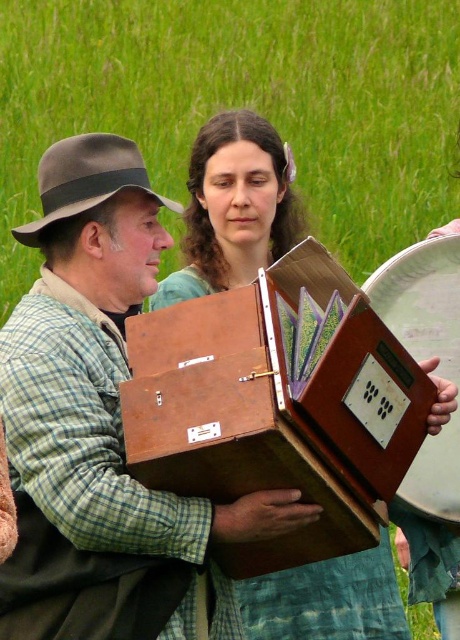
You are setting up for a street performance and need to place the wooden accordion at center and the wooden box at center on a small stage. The stage has limited vertical space. Based on the image, which object should you avoid placing if you want to maximize the number of items you can fit vertically?

The wooden accordion at center is much taller than the wooden box at center, so you should avoid placing the wooden accordion at center to maximize the number of items you can fit vertically.

You are standing in front of the two performers and want to take a photo of the wooden box at center without the wooden accordion at center blocking it. How should you adjust your position?

Move your position so that the wooden box at center is no longer behind the wooden accordion at center. Since the wooden accordion at center is closer to the viewer than the wooden box at center, you can step back to create more distance between yourself and the performers, allowing the wooden box at center to appear in front of the wooden accordion at center in the photo.

You are standing in front of a musical performance setup. You see a wooden accordion at center and a wooden box at center. Which object is positioned to the left?

The wooden accordion at center is to the left of the wooden box at center.